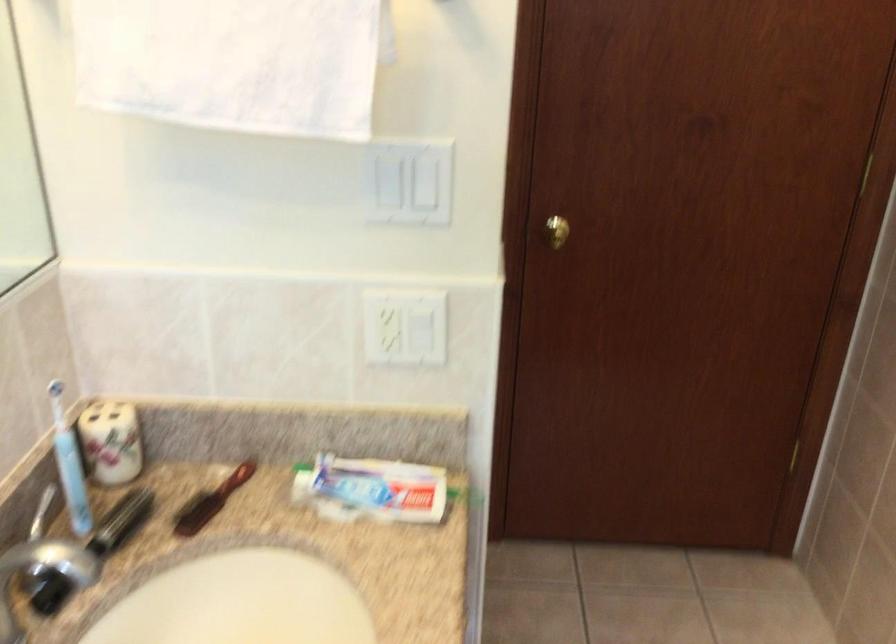
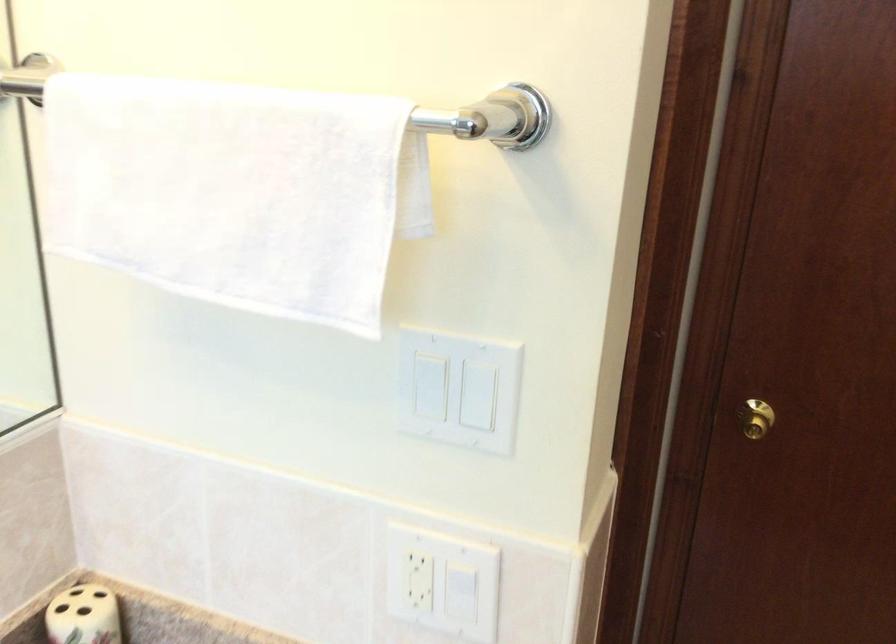
Question: The camera is either moving clockwise (left) or counter-clockwise (right) around the object. The first image is from the beginning of the video and the second image is from the end. Is the camera moving left or right when shooting the video?

Choices:
 (A) Left
 (B) Right

Answer: (B)